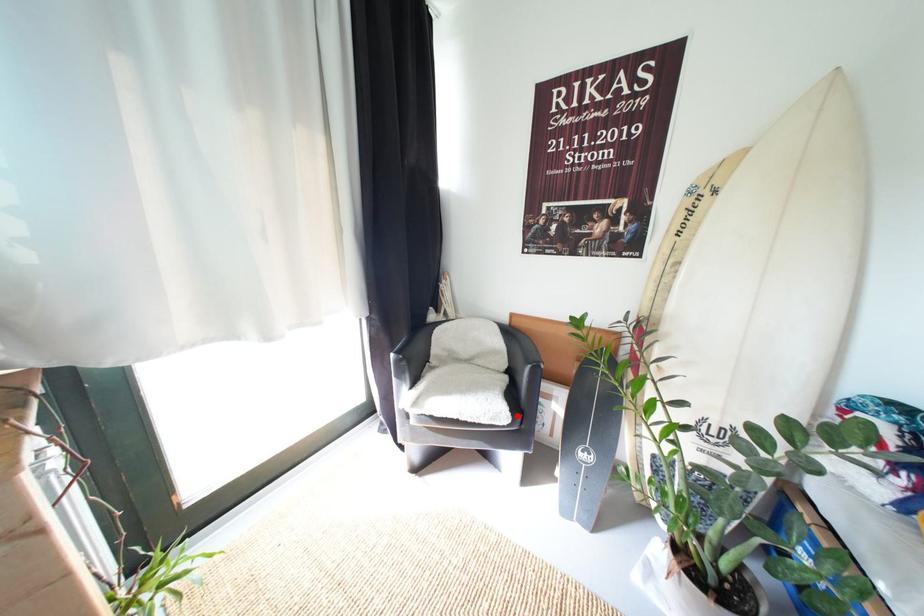
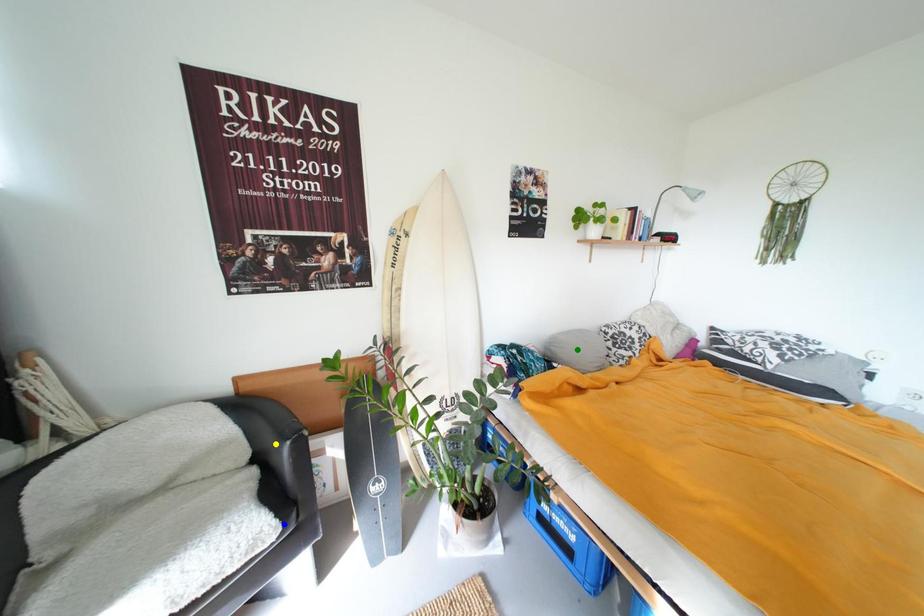
Question: I am providing you with two images of the same scene from different viewpoints. A red point is marked on the first image. You are given multiple points on the second image. Which mark in image 2 goes with the point in image 1?

Choices:
 (A) green point
 (B) blue point
 (C) yellow point

Answer: (B)